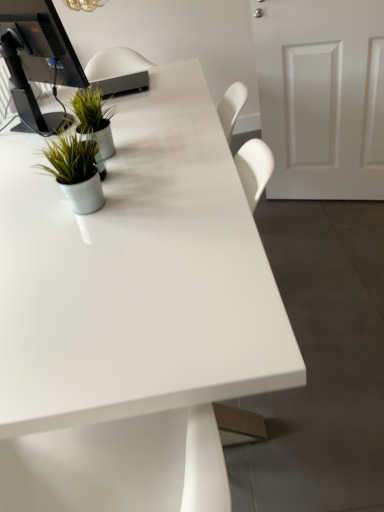
Locate an element on the screen. This screenshot has height=512, width=384. free space to the right of metallic silver pot at left, which is counted as the first houseplant, starting from the bottom is located at coordinates (146, 186).